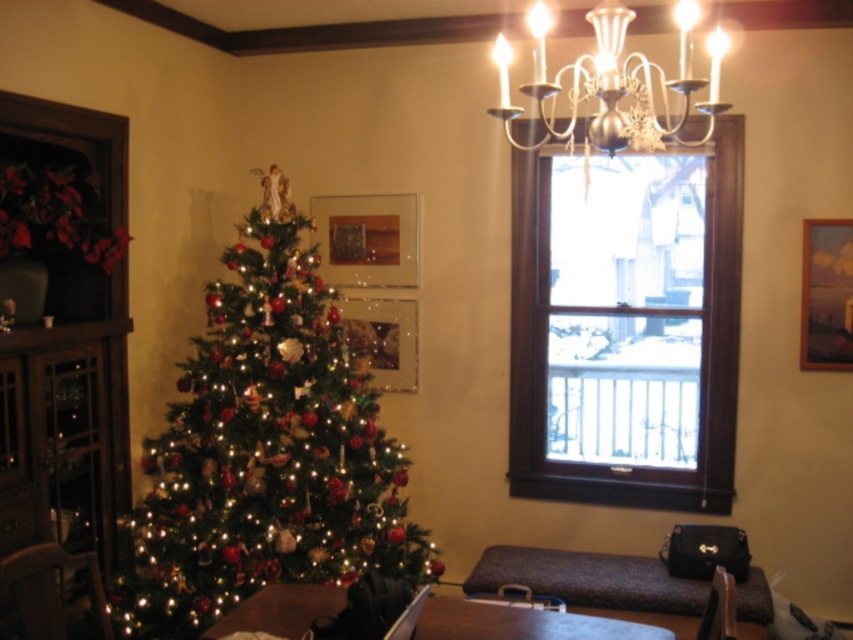
You are a guest entering the room and want to sit down. There is a matte brown chair at lower left and a silver metallic chandelier at upper center. Which object is closer to the entrance?

The matte brown chair at lower left is closer to the entrance because it is positioned to the left of the silver metallic chandelier at upper center, which is further away from the entrance.

You are standing in the room and want to sit down. The matte brown chair at lower left is located at point (50, 589). Can you walk directly to the chair without moving around any furniture?

Yes, you can walk directly to the matte brown chair at lower left because it is positioned at point (50, 589), which suggests it is near the lower left corner of the room, likely with clear space around it for easy access.

You are a guest entering the room and want to sit down. You notice the silver metallic chandelier at upper center and the matte brown chair at lower left. Which object is taller?

The silver metallic chandelier at upper center is much taller than the matte brown chair at lower left.